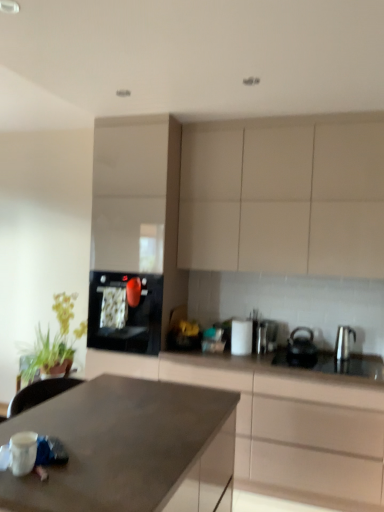
Question: Does white glossy cabinet at center, the first cabinetry when ordered from back to front, appear on the right side of matte gray countertop at center?

Choices:
 (A) no
 (B) yes

Answer: (A)

Question: From the image's perspective, is white glossy cabinet at center, marked as the third cabinetry in a front-to-back arrangement, located beneath matte gray countertop at center?

Choices:
 (A) yes
 (B) no

Answer: (B)

Question: From a real-world perspective, is white glossy cabinet at center, marked as the third cabinetry in a front-to-back arrangement, located higher than matte gray countertop at center?

Choices:
 (A) yes
 (B) no

Answer: (A)

Question: Could you tell me if white glossy cabinet at center, the first cabinetry when ordered from back to front, is facing matte gray countertop at center?

Choices:
 (A) yes
 (B) no

Answer: (B)

Question: Can we say white glossy cabinet at center, marked as the third cabinetry in a front-to-back arrangement, lies outside matte gray countertop at center?

Choices:
 (A) no
 (B) yes

Answer: (B)

Question: Looking at the image, does satin silver kettle at right, placed as the 3th kitchen appliance when sorted from left to right, seem bigger or smaller compared to black matte kettle at right, the 2th kitchen appliance from the right?

Choices:
 (A) big
 (B) small

Answer: (B)

Question: Does point (342, 339) appear closer or farther from the camera than point (296, 356)?

Choices:
 (A) farther
 (B) closer

Answer: (A)

Question: From the image's perspective, is satin silver kettle at right, marked as the first kitchen appliance in a right-to-left arrangement, located above or below black matte kettle at right, which appears as the 2th kitchen appliance when viewed from the left?

Choices:
 (A) above
 (B) below

Answer: (A)

Question: From a real-world perspective, relative to black matte kettle at right, which appears as the 2th kitchen appliance when viewed from the left, is satin silver kettle at right, marked as the first kitchen appliance in a right-to-left arrangement, vertically above or below?

Choices:
 (A) below
 (B) above

Answer: (B)

Question: In terms of size, does white glossy cup at upper center, placed as the second appliance when sorted from right to left, appear bigger or smaller than matte brown cabinet at center, the first cabinetry positioned from the front?

Choices:
 (A) small
 (B) big

Answer: (A)

Question: Do you think white glossy cup at upper center, which appears as the first appliance when viewed from the left, is within matte brown cabinet at center, the first cabinetry positioned from the front, or outside of it?

Choices:
 (A) inside
 (B) outside

Answer: (B)

Question: Considering the relative positions of white glossy cup at upper center, placed as the second appliance when sorted from right to left, and matte brown cabinet at center, the third cabinetry from the back, in the image provided, is white glossy cup at upper center, placed as the second appliance when sorted from right to left, to the left or to the right of matte brown cabinet at center, the third cabinetry from the back,?

Choices:
 (A) right
 (B) left

Answer: (B)

Question: From the image's perspective, is white glossy cup at upper center, which appears as the first appliance when viewed from the left, located above or below matte brown cabinet at center, the third cabinetry from the back?

Choices:
 (A) below
 (B) above

Answer: (B)

Question: From the image's perspective, is green leafy plant at left above or below matte gray countertop at center?

Choices:
 (A) below
 (B) above

Answer: (B)

Question: Looking at the image, does green leafy plant at left seem bigger or smaller compared to matte gray countertop at center?

Choices:
 (A) big
 (B) small

Answer: (B)